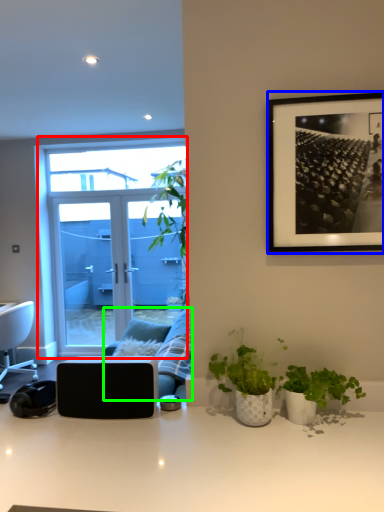
Question: Estimate the real-world distances between objects in this image. Which object is farther from window (highlighted by a red box), picture frame (highlighted by a blue box) or studio couch (highlighted by a green box)?

Choices:
 (A) picture frame
 (B) studio couch

Answer: (A)